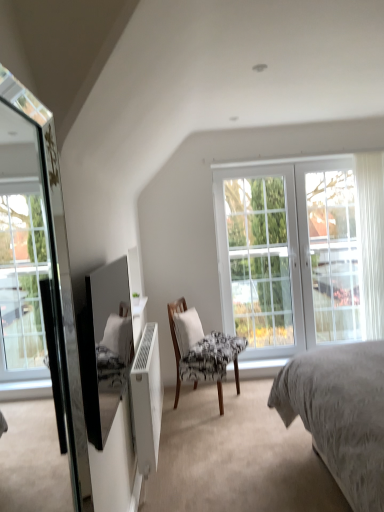
Question: Is white glass screen door at right at the left side of white glass window at center, the second window viewed from the left?

Choices:
 (A) yes
 (B) no

Answer: (B)

Question: Is white glass screen door at right smaller than white glass window at center, the first window when ordered from right to left?

Choices:
 (A) yes
 (B) no

Answer: (A)

Question: Is white glass screen door at right next to white glass window at center, the first window when ordered from right to left, and touching it?

Choices:
 (A) yes
 (B) no

Answer: (B)

Question: Considering the relative positions of white glass screen door at right and white glass window at center, the second window viewed from the left, in the image provided, is white glass screen door at right behind white glass window at center, the second window viewed from the left,?

Choices:
 (A) yes
 (B) no

Answer: (A)

Question: From the image's perspective, is white glass screen door at right beneath white glass window at center, the second window viewed from the left?

Choices:
 (A) no
 (B) yes

Answer: (A)

Question: Is white glass screen door at right spatially inside white glass window at center, positioned as the second window in right-to-left order, or outside of it?

Choices:
 (A) inside
 (B) outside

Answer: (B)

Question: From a real-world perspective, is white glass screen door at right above or below white glass window at center, acting as the first window starting from the left?

Choices:
 (A) above
 (B) below

Answer: (A)

Question: Is white glass screen door at right taller or shorter than white glass window at center, positioned as the second window in right-to-left order?

Choices:
 (A) tall
 (B) short

Answer: (B)

Question: Considering the positions of point (309, 291) and point (243, 282), is point (309, 291) closer or farther from the camera than point (243, 282)?

Choices:
 (A) farther
 (B) closer

Answer: (B)

Question: In the image, is white glass window at center, positioned as the second window in right-to-left order, on the left side or the right side of black glossy mirror at left, positioned as the second mirror in front-to-back order?

Choices:
 (A) left
 (B) right

Answer: (B)

Question: Is point [286, 208] closer or farther from the camera than point [91, 361]?

Choices:
 (A) closer
 (B) farther

Answer: (B)

Question: Is white glass window at center, positioned as the second window in right-to-left order, wider or thinner than black glossy mirror at left, the 1th mirror positioned from the back?

Choices:
 (A) wide
 (B) thin

Answer: (A)

Question: From a real-world perspective, is white glass window at center, positioned as the second window in right-to-left order, physically located above or below black glossy mirror at left, the 1th mirror positioned from the back?

Choices:
 (A) above
 (B) below

Answer: (B)

Question: Considering the positions of white glass screen door at right and white fabric pillow at center in the image, is white glass screen door at right taller or shorter than white fabric pillow at center?

Choices:
 (A) short
 (B) tall

Answer: (B)

Question: Do you think white glass screen door at right is within white fabric pillow at center, or outside of it?

Choices:
 (A) inside
 (B) outside

Answer: (B)